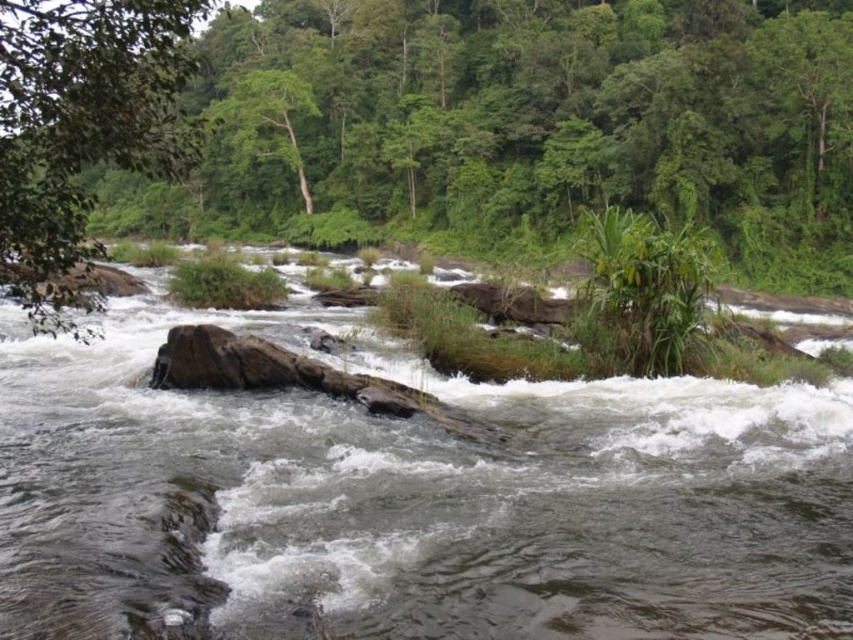
Question: Can you confirm if brown rock at center is bigger than green leafy tree at upper center?

Choices:
 (A) yes
 (B) no

Answer: (B)

Question: Can you confirm if brown rock at center is positioned above green leafy tree at upper center?

Choices:
 (A) yes
 (B) no

Answer: (B)

Question: Among these objects, which one is nearest to the camera?

Choices:
 (A) green leafy tree at upper center
 (B) brown rock at center
 (C) green leafy tree at left

Answer: (B)

Question: Estimate the real-world distances between objects in this image. Which object is farther from the green leafy tree at left?

Choices:
 (A) green leafy tree at upper center
 (B) brown rock at center

Answer: (A)

Question: Can you confirm if brown rock at center is positioned to the right of green leafy tree at left?

Choices:
 (A) no
 (B) yes

Answer: (B)

Question: Which object is farther from the camera taking this photo?

Choices:
 (A) brown rock at center
 (B) green leafy tree at left

Answer: (B)